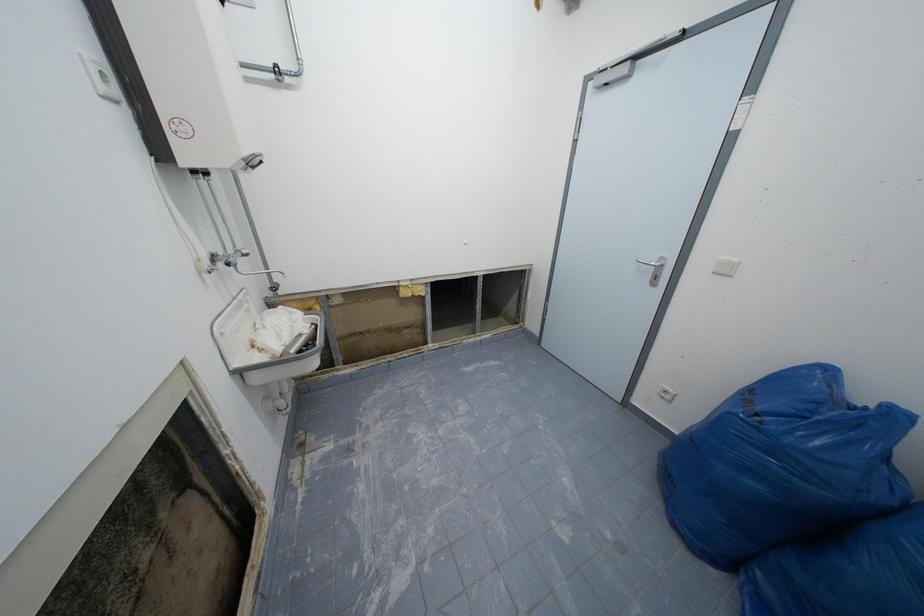
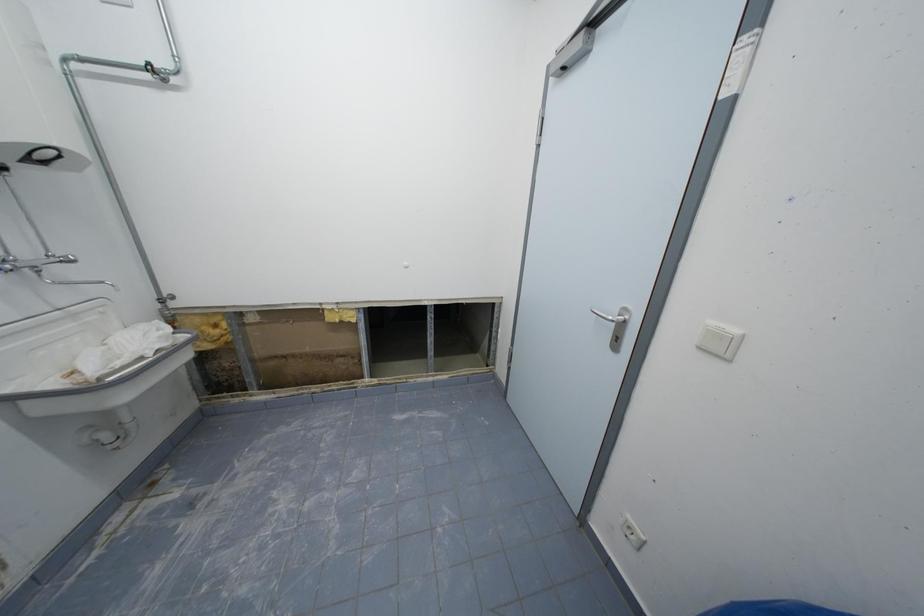
Question: The camera is either moving clockwise (left) or counter-clockwise (right) around the object. The first image is from the beginning of the video and the second image is from the end. Is the camera moving left or right when shooting the video?

Choices:
 (A) Left
 (B) Right

Answer: (B)